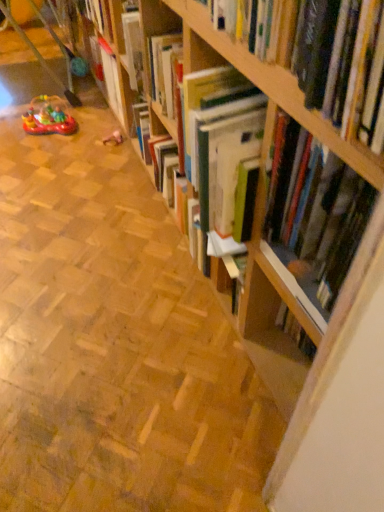
Find the location of `free space to the back side of rubber boat at left, placed as the second toy when sorted from right to left`. free space to the back side of rubber boat at left, placed as the second toy when sorted from right to left is located at coordinates (70, 102).